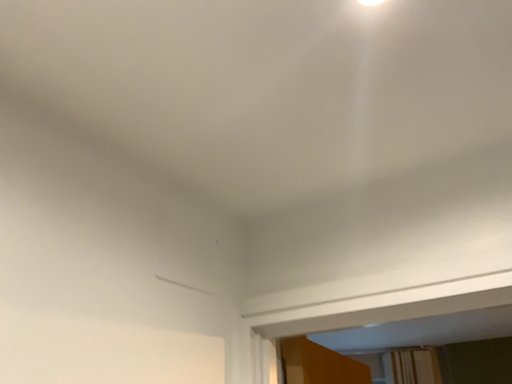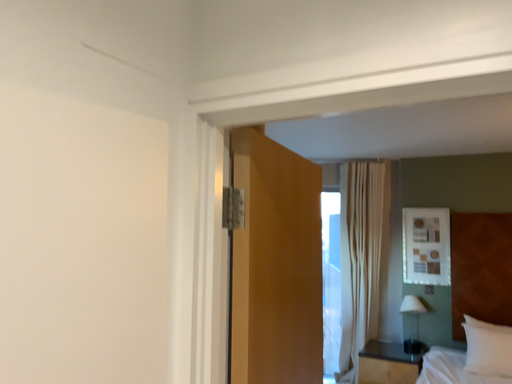
Question: How did the camera likely rotate when shooting the video?

Choices:
 (A) rotated upward
 (B) rotated downward

Answer: (B)